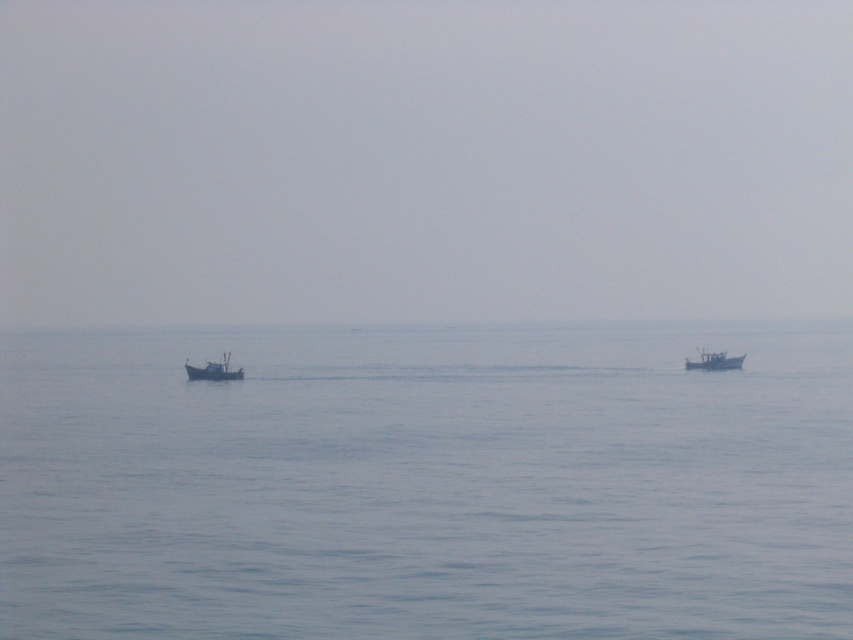
Who is lower down, gray matte sea at center or metallic gray boat at right?

metallic gray boat at right is lower down.

Measure the distance between gray matte sea at center and metallic gray boat at right.

gray matte sea at center is 251.19 meters from metallic gray boat at right.

Identify the location of gray matte sea at center. (422, 161).

What do you see at coordinates (427, 484) in the screenshot?
I see `blue water at center` at bounding box center [427, 484].

Is blue water at center shorter than wooden fishing boat at left?

No.

Who is more forward, (337, 595) or (233, 372)?

Positioned in front is point (337, 595).

This screenshot has width=853, height=640. Identify the location of blue water at center. (427, 484).

Between wooden fishing boat at left and metallic gray boat at right, which one appears on the right side from the viewer's perspective?

metallic gray boat at right

Is point (216, 372) closer to camera compared to point (729, 368)?

Yes, point (216, 372) is in front of point (729, 368).

I want to click on wooden fishing boat at left, so click(x=213, y=371).

Identify the location of wooden fishing boat at left. (213, 371).